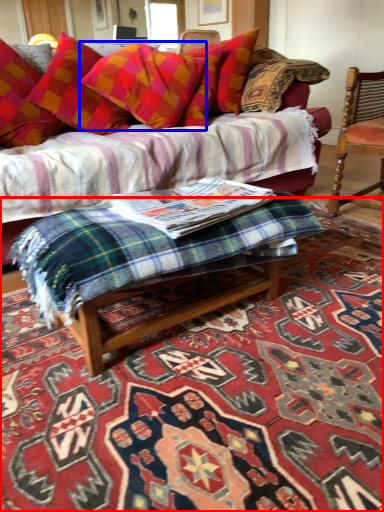
Question: Which point is closer to the camera, mat (highlighted by a red box) or pillow (highlighted by a blue box)?

Choices:
 (A) mat
 (B) pillow

Answer: (A)